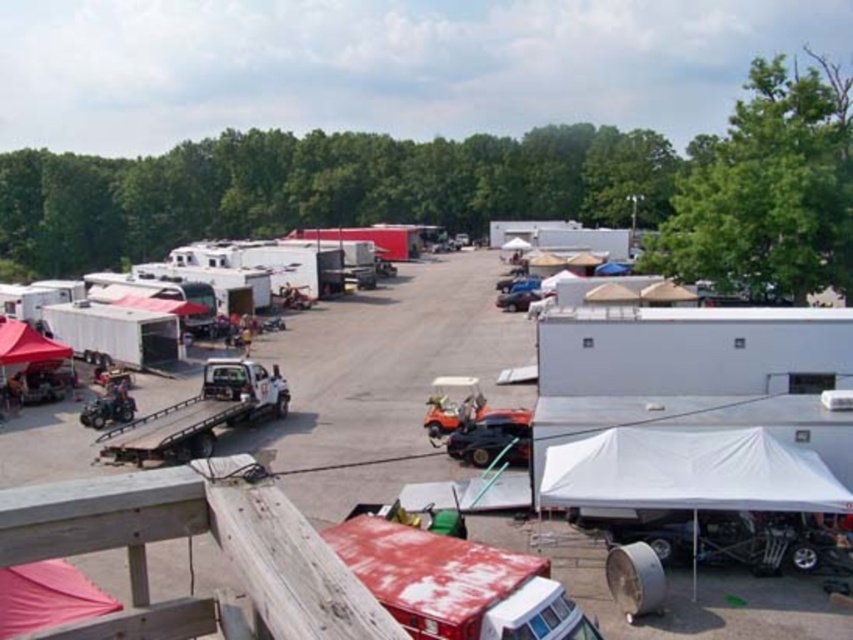
You are planning to park a new vehicle that is 2 meters wide. The white matte trailer at center and the white fabric tent at lower right are already in the area. Based on their widths, which one can accommodate the new vehicle if placed next to them?

The white matte trailer at center has a greater width than the white fabric tent at lower right, so placing the new vehicle next to the white fabric tent at lower right might be possible if there is enough space, but the trailer is wider so it depends on exact measurements.